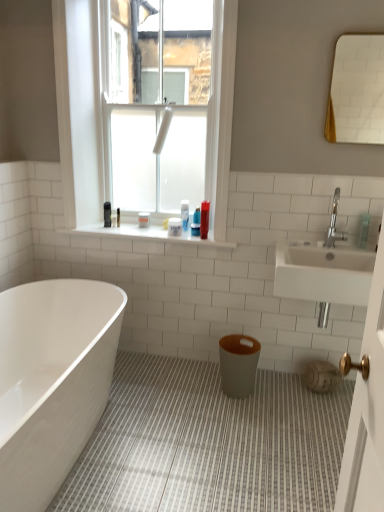
Question: Is silver metallic faucet at upper right taller or shorter than translucent plastic bottle at upper center, acting as the third toiletry starting from the left?

Choices:
 (A) short
 (B) tall

Answer: (B)

Question: Is silver metallic faucet at upper right inside or outside of translucent plastic bottle at upper center, the second toiletry viewed from the back?

Choices:
 (A) outside
 (B) inside

Answer: (A)

Question: Which of these objects is positioned farthest from the white glossy mirror at upper right?

Choices:
 (A) matte gray vase at lower right
 (B) white tile at upper center
 (C) white matte container at window, which appears as the first toiletry when viewed from the back
 (D) clear plastic bottle at upper right, the fifth toiletry in the back-to-front sequence
 (E) translucent plastic bottle at upper center, placed as the fourth toiletry when sorted from front to back

Answer: (C)

Question: Based on their relative distances, which object is nearer to the white glossy bathtub at lower left?

Choices:
 (A) matte gray vase at lower right
 (B) white tile at upper center
 (C) matte gray toilet bowl at center
 (D) clear plastic bottle at upper right, the fifth toiletry in the back-to-front sequence
 (E) silver metallic faucet at upper right

Answer: (B)